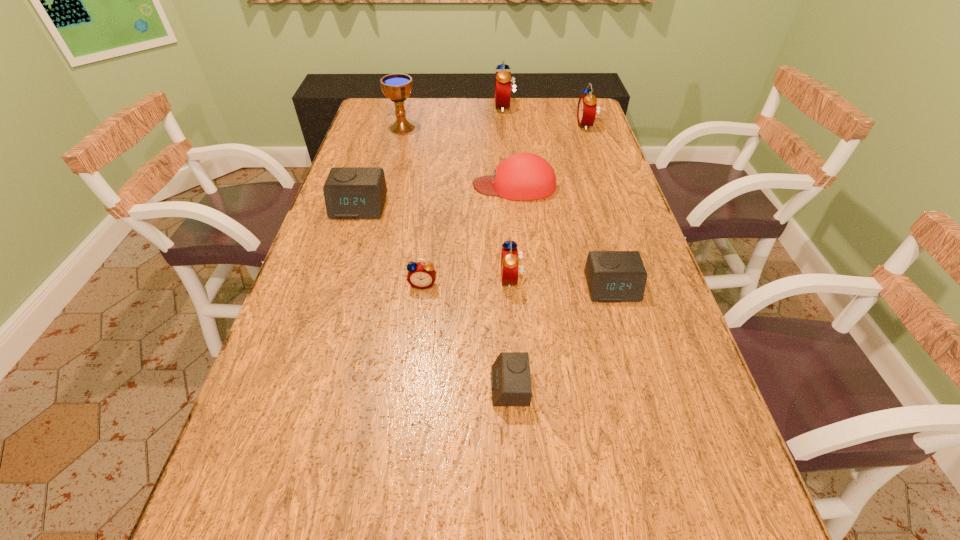
Where is `the smallest red alarm clock`? the smallest red alarm clock is located at coordinates tap(421, 275).

The height and width of the screenshot is (540, 960). What are the coordinates of `the second smallest black alarm clock` in the screenshot? It's located at (612, 276).

In order to click on the second nearest black alarm clock in this screenshot , I will do `click(612, 276)`.

Where is `the nearest object`? the nearest object is located at coordinates (511, 385).

Where is `the shortest object`? This screenshot has width=960, height=540. the shortest object is located at coordinates (511, 385).

Identify the location of free region located 0.280m on the front-facing side of the farthest red alarm clock. (422, 107).

The height and width of the screenshot is (540, 960). Find the location of `free space located on the front-facing side of the farthest red alarm clock`. free space located on the front-facing side of the farthest red alarm clock is located at coordinates (451, 107).

Locate an element on the screen. blank space located on the front-facing side of the farthest red alarm clock is located at coordinates (392, 107).

Where is `free region located on the front of the blue chalice`? The width and height of the screenshot is (960, 540). free region located on the front of the blue chalice is located at coordinates (398, 145).

At what (x,y) coordinates should I click in order to perform the action: click on vacant position located 0.160m on the front-facing side of the second tallest alarm clock. Please return your answer as a coordinate pair (x, y). The width and height of the screenshot is (960, 540). Looking at the image, I should click on (534, 125).